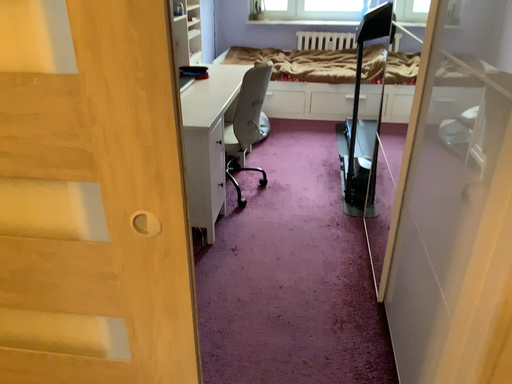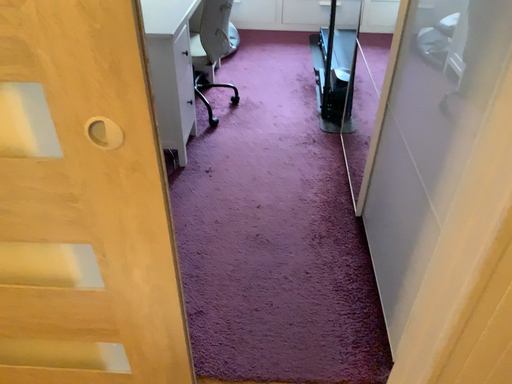
Question: How did the camera likely rotate when shooting the video?

Choices:
 (A) rotated downward
 (B) rotated upward

Answer: (A)